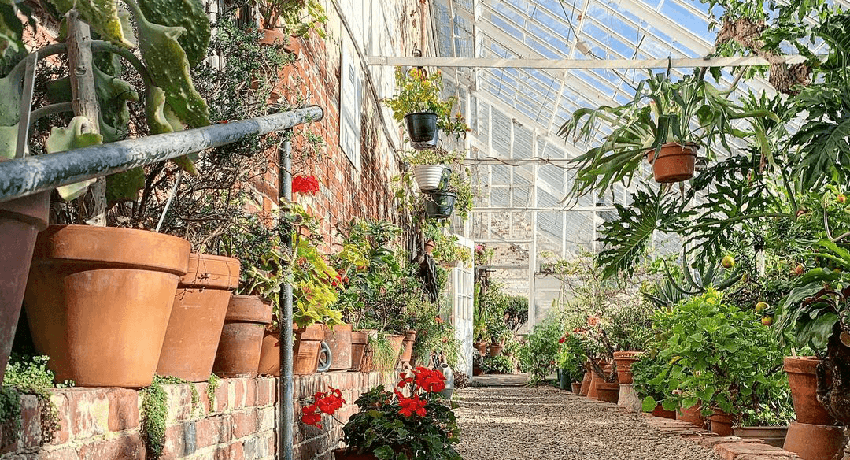
I want to click on white plastic pots, so click(x=423, y=173).